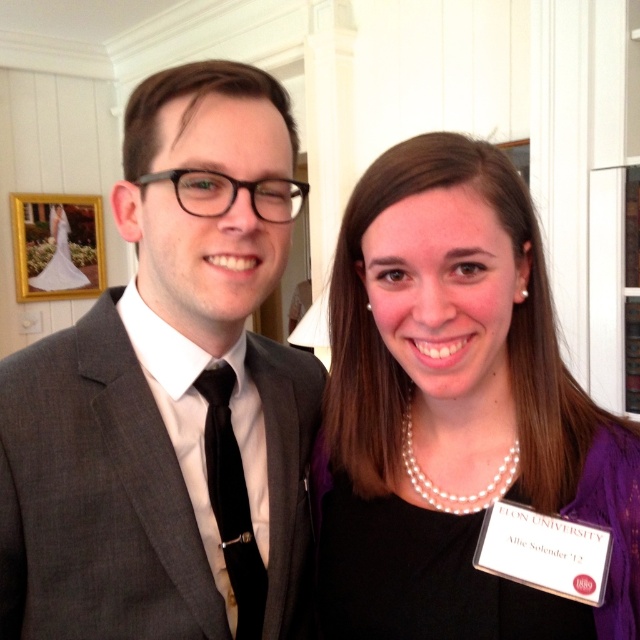
Based on the photo, you are standing in the room and want to place a small gift on the floor exactly at point (227, 422). If you can reach 29.45 inches, can you place the gift without moving?

Yes, because the distance between you and point (227, 422) is exactly 29.45 inches, which matches your reach.